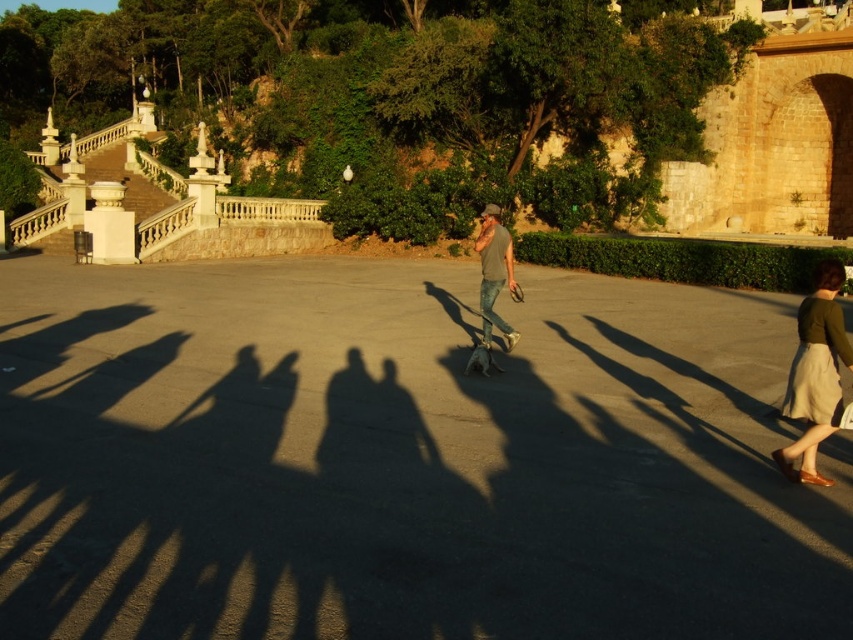
Is matte gray shirt at center to the right of wooden skateboard at center from the viewer's perspective?

Correct, you'll find matte gray shirt at center to the right of wooden skateboard at center.

Is point (497, 276) positioned after point (490, 365)?

Yes, it is.

Identify the location of matte gray shirt at center. (494, 273).

I want to click on matte gray shirt at center, so click(494, 273).

Which is more to the right, green fabric skirt at right or matte gray shirt at center?

green fabric skirt at right

Is green fabric skirt at right thinner than matte gray shirt at center?

Correct, green fabric skirt at right's width is less than matte gray shirt at center's.

Between point (836, 291) and point (492, 266), which one is positioned in front?

Point (836, 291) is more forward.

Identify the location of green fabric skirt at right. (815, 374).

Who is more forward, (804, 406) or (483, 349)?

Point (804, 406) is more forward.

Is green fabric skirt at right closer to the viewer compared to wooden skateboard at center?

Yes, it is in front of wooden skateboard at center.

Is point (802, 376) more distant than point (480, 369)?

No.

You are a GUI agent. You are given a task and a screenshot of the screen. Output one action in this format:
    pyautogui.click(x=<x>, y=<y>)
    Task: Click on the green fabric skirt at right
    
    Given the screenshot: What is the action you would take?
    pyautogui.click(x=815, y=374)